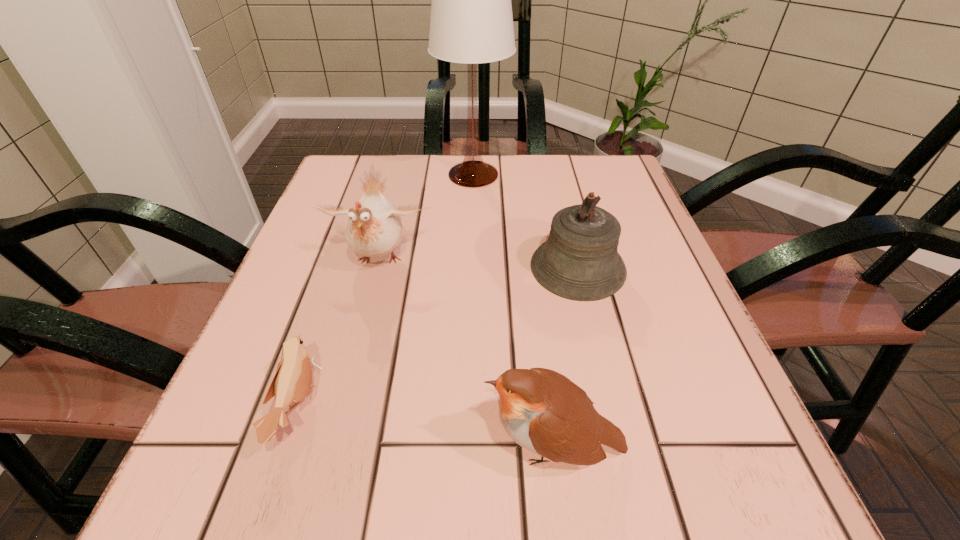
Find the location of `vacant point at the far right corner`. vacant point at the far right corner is located at coordinates (623, 162).

In the image, there is a desktop. At what (x,y) coordinates should I click in order to perform the action: click on vacant region at the near right corner. Please return your answer as a coordinate pair (x, y). Looking at the image, I should click on (682, 502).

In order to click on empty location between the shortest object and the rightmost bird in this screenshot , I will do `click(426, 427)`.

Where is `free point between the shortest object and the table lamp`? free point between the shortest object and the table lamp is located at coordinates (386, 291).

Where is `empty location between the rightmost bird and the farthest bird`? The image size is (960, 540). empty location between the rightmost bird and the farthest bird is located at coordinates (467, 354).

At what (x,y) coordinates should I click in order to perform the action: click on free point between the rightmost bird and the tallest object. Please return your answer as a coordinate pair (x, y). The image size is (960, 540). Looking at the image, I should click on (514, 311).

Where is `free spot between the farthest bird and the shortest bird`? Image resolution: width=960 pixels, height=540 pixels. free spot between the farthest bird and the shortest bird is located at coordinates (339, 334).

You are a GUI agent. You are given a task and a screenshot of the screen. Output one action in this format:
    pyautogui.click(x=<x>, y=<y>)
    Task: Click on the free space between the rightmost bird and the table lamp
    This screenshot has width=960, height=540.
    Given the screenshot: What is the action you would take?
    pyautogui.click(x=514, y=311)

Locate an element on the screen. The image size is (960, 540). vacant area that lies between the farthest object and the bell is located at coordinates (526, 221).

Identify the location of vacant space that is in between the bell and the farthest bird. tap(479, 265).